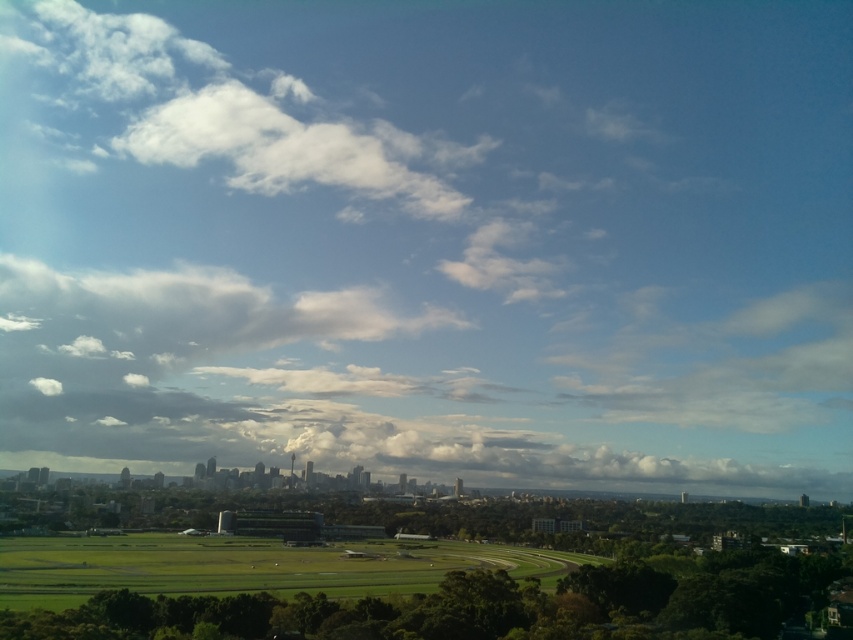
You are a photographer planning to capture the city skyline with both the white fluffy cloud at upper left and the green grassy field at center in the same frame. Based on their sizes in the image, which object would appear larger in the photo?

The white fluffy cloud at upper left appears larger in the photo because it is much taller than the green grassy field at center.

You are a drone operator who needs to fly your drone from the green grassy field at center to the white fluffy cloud at upper left. Based on the scene, can you determine if the drone can reach the cloud from the field?

The white fluffy cloud at upper left is located above the green grassy field at center, so the drone can reach the cloud from the field as it is positioned higher in the sky.